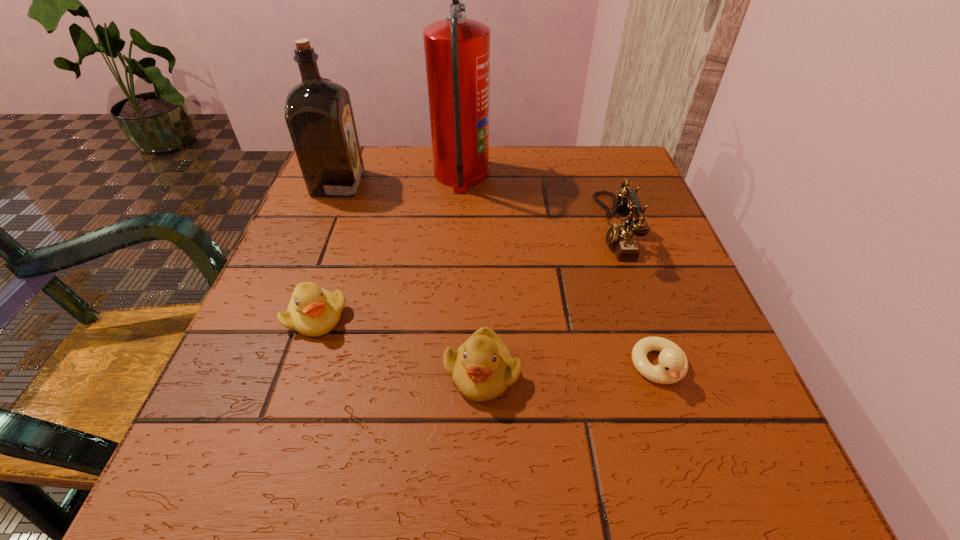
This screenshot has width=960, height=540. In order to click on telephone positioned at the right edge in this screenshot , I will do `click(621, 236)`.

Locate an element on the screen. This screenshot has height=540, width=960. duckling that is at the right edge is located at coordinates (673, 365).

The image size is (960, 540). I want to click on object present at the far left corner, so click(318, 112).

Where is `object situated at the far right corner`? object situated at the far right corner is located at coordinates (621, 236).

Image resolution: width=960 pixels, height=540 pixels. In the image, there is a desktop. Identify the location of vacant space at the far edge. point(565,200).

Locate an element on the screen. This screenshot has width=960, height=540. vacant space at the left edge is located at coordinates (339, 206).

At what (x,y) coordinates should I click in order to perform the action: click on vacant space at the right edge of the desktop. Please return your answer as a coordinate pair (x, y). The height and width of the screenshot is (540, 960). Looking at the image, I should click on (663, 240).

Identify the location of vacant region at the far right corner of the desktop. The image size is (960, 540). (618, 156).

This screenshot has width=960, height=540. What are the coordinates of `blank space at the near right corner of the desktop` in the screenshot? It's located at (708, 436).

Where is `vacant space that's between the fourth shortest object and the fourth farthest object`? The width and height of the screenshot is (960, 540). vacant space that's between the fourth shortest object and the fourth farthest object is located at coordinates (465, 272).